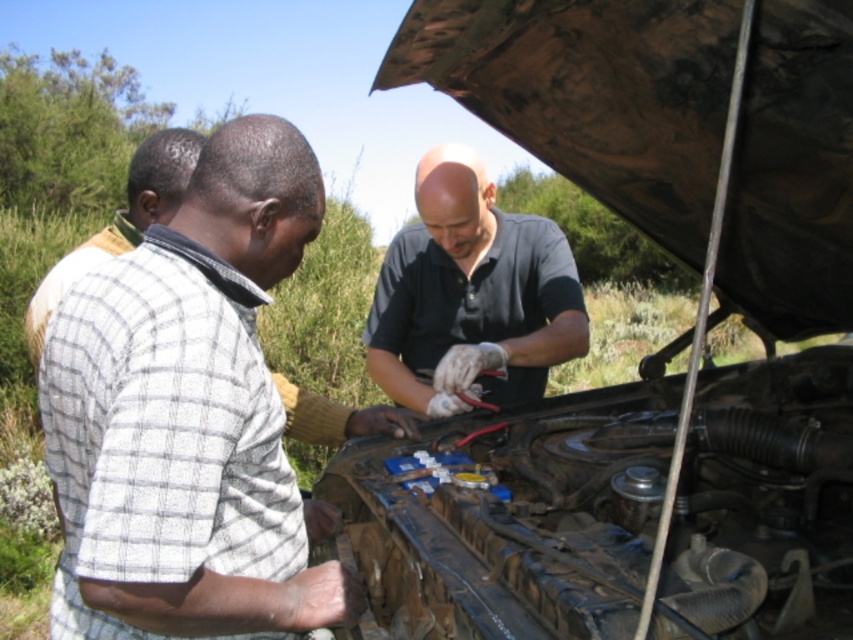
Question: Is white checkered shirt at center in front of white checkered shirt at left?

Choices:
 (A) yes
 (B) no

Answer: (A)

Question: Which of these objects is positioned farthest from the white checkered shirt at left?

Choices:
 (A) white checkered shirt at center
 (B) dark gray shirt at center
 (C) rusty metal engine at center

Answer: (C)

Question: Among these objects, which one is farthest from the camera?

Choices:
 (A) rusty metal engine at center
 (B) white checkered shirt at center
 (C) dark gray shirt at center
 (D) white checkered shirt at left

Answer: (C)

Question: Does rusty metal engine at center appear on the right side of white checkered shirt at center?

Choices:
 (A) yes
 (B) no

Answer: (A)

Question: Is rusty metal engine at center behind white checkered shirt at left?

Choices:
 (A) yes
 (B) no

Answer: (B)

Question: Which of the following is the farthest from the observer?

Choices:
 (A) white checkered shirt at left
 (B) dark gray shirt at center
 (C) white checkered shirt at center

Answer: (B)